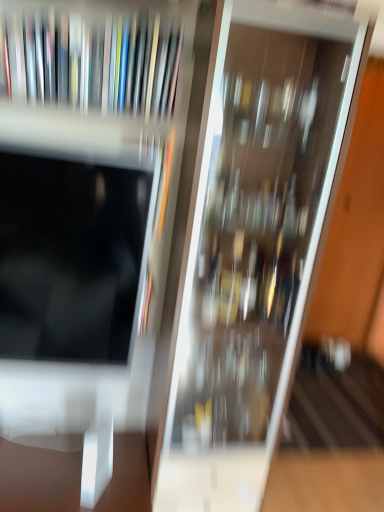
This screenshot has width=384, height=512. Identify the location of free space above matte plastic books at upper left (from a real-world perspective). (84, 12).